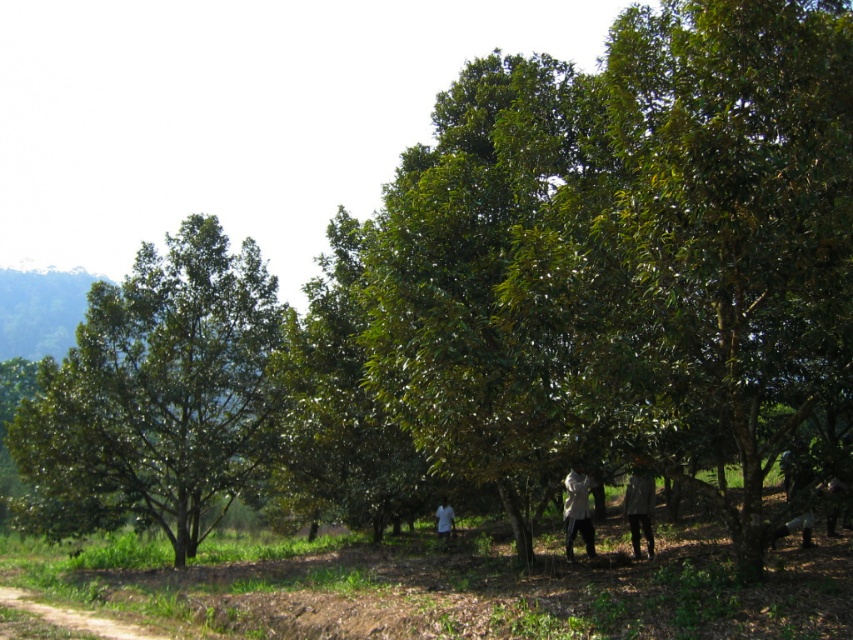
You are standing at the center of the orchard and want to reach the green leafy tree at left. Which direction should you head towards?

The green leafy tree at left is located at point (155,394), which means it is positioned to the left and slightly forward from your current position at the center. You should head towards the left and slightly forward direction to reach it.

You are standing in the orchard and want to pick a fruit from the green leafy tree at left. Can you reach the fruit without any tools?

The distance between you and the green leafy tree at left is 16.85 meters, which is too far to reach without any tools. You would need to move closer or use a ladder.

You are a farmer who needs to reach the white fabric coat at center from the green leafy tree at left. Given that your tractor can only move in straight lines and has a maximum turning radius of 20 feet, can you drive directly to the coat without turning?

The distance between the green leafy tree at left and the white fabric coat at center is 37.63 feet. Since the tractor can move in straight lines and doesn t require turning for a direct path, you can drive directly to the coat without turning.